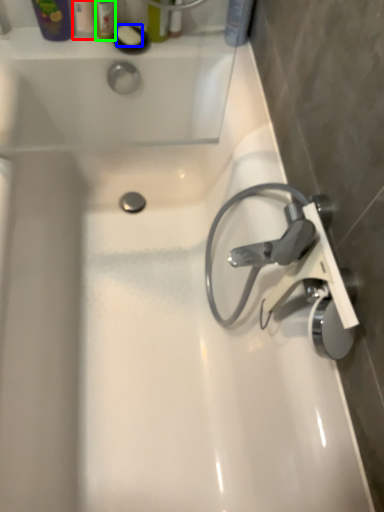
Question: Based on their relative distances, which object is farther from toiletry (highlighted by a red box)? Choose from soap (highlighted by a blue box) and toiletry (highlighted by a green box).

Choices:
 (A) soap
 (B) toiletry

Answer: (A)